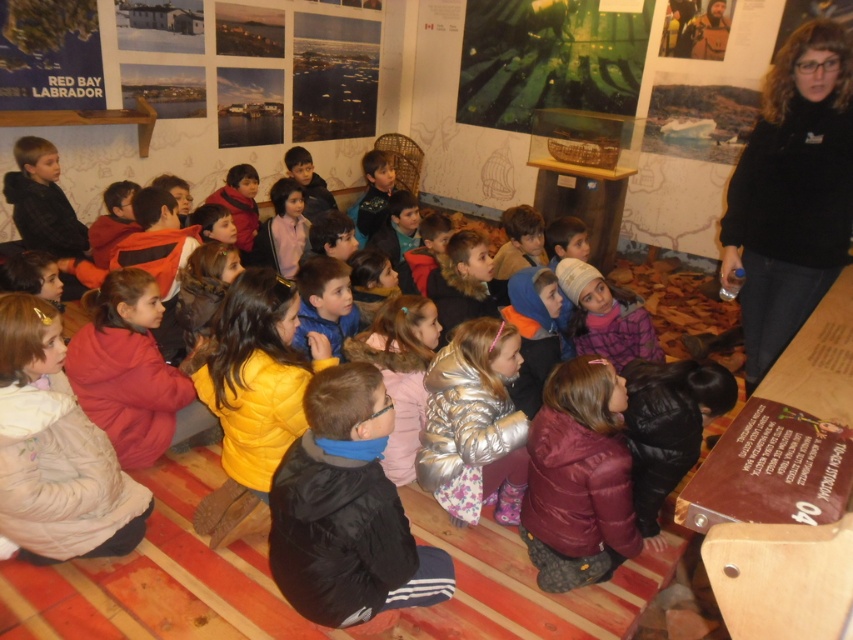
In the scene shown: You are a photographer trying to capture a group shot of the children. You notice the black fleece jacket at upper right and the pink fabric jacket at center. Which jacket is more likely to be in the background of the photo if you focus on the children in the front?

The black fleece jacket at upper right is wider than the pink fabric jacket at center, so it might be positioned further back, making it more likely to be in the background of the photo if focusing on the children in the front.

You are a photographer trying to capture a clear shot of the metallic silver jacket at center without the light beige puffy jacket at lower left blocking it. From your current position, can you adjust your angle to avoid the obstruction?

The light beige puffy jacket at lower left is in front of the metallic silver jacket at center, so you need to move your position to the side or behind the light beige puffy jacket at lower left to capture the metallic silver jacket at center without obstruction.